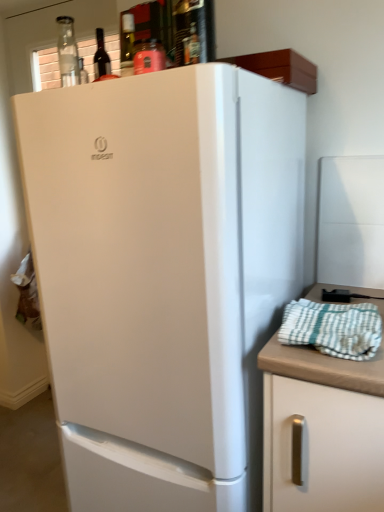
Image resolution: width=384 pixels, height=512 pixels. What are the coordinates of `matte glass wine bottle at upper center` in the screenshot? It's located at (101, 58).

Locate an element on the screen. The image size is (384, 512). matte glass wine bottle at upper center is located at coordinates (101, 58).

This screenshot has width=384, height=512. Identify the location of refrigerator on the left of white checkered towel at right. (163, 276).

How much distance is there between white matte refrigerator at center and white checkered towel at right?

A distance of 37.03 centimeters exists between white matte refrigerator at center and white checkered towel at right.

Is white matte refrigerator at center far from white checkered towel at right?

No, there isn't a large distance between white matte refrigerator at center and white checkered towel at right.

Does white matte refrigerator at center have a smaller size compared to white checkered towel at right?

No.

Is matte glass wine bottle at upper center positioned with its back to white checkered towel at right?

No, white checkered towel at right is not at the back of matte glass wine bottle at upper center.

Would you say matte glass wine bottle at upper center is outside white checkered towel at right?

matte glass wine bottle at upper center is positioned outside white checkered towel at right.

In the image, is matte glass wine bottle at upper center positioned in front of or behind white checkered towel at right?

In the image, matte glass wine bottle at upper center appears behind white checkered towel at right.

Which of these two, matte glass wine bottle at upper center or white checkered towel at right, is bigger?

With larger size is white checkered towel at right.

Is the surface of white matte cabinet at right in direct contact with white matte refrigerator at center?

white matte cabinet at right and white matte refrigerator at center are not in contact.

Who is shorter, white matte cabinet at right or white matte refrigerator at center?

With less height is white matte cabinet at right.

Which object is thinner, white matte cabinet at right or white matte refrigerator at center?

white matte cabinet at right is thinner.

Can you confirm if white matte refrigerator at center is bigger than white matte cabinet at right?

Indeed, white matte refrigerator at center has a larger size compared to white matte cabinet at right.

Considering the positions of points (206, 289) and (368, 372), is point (206, 289) farther from camera compared to point (368, 372)?

Yes, point (206, 289) is behind point (368, 372).

From a real-world perspective, is white matte refrigerator at center positioned above or below white matte cabinet at right?

white matte refrigerator at center is above white matte cabinet at right.

Is white matte refrigerator at center to the left or to the right of white matte cabinet at right in the image?

white matte refrigerator at center is to the left of white matte cabinet at right.

Considering the sizes of matte glass wine bottle at upper center and white matte refrigerator at center in the image, is matte glass wine bottle at upper center taller or shorter than white matte refrigerator at center?

Considering their sizes, matte glass wine bottle at upper center has less height than white matte refrigerator at center.

Considering the relative positions of matte glass wine bottle at upper center and white matte refrigerator at center in the image provided, is matte glass wine bottle at upper center to the right of white matte refrigerator at center from the viewer's perspective?

Incorrect, matte glass wine bottle at upper center is not on the right side of white matte refrigerator at center.

How distant is matte glass wine bottle at upper center from white matte refrigerator at center?

matte glass wine bottle at upper center is 27.18 inches away from white matte refrigerator at center.

In terms of width, does matte glass wine bottle at upper center look wider or thinner when compared to white matte refrigerator at center?

Considering their sizes, matte glass wine bottle at upper center looks slimmer than white matte refrigerator at center.

Which object is positioned more to the left, white checkered towel at right or white matte cabinet at right?

Positioned to the left is white checkered towel at right.

Are white checkered towel at right and white matte cabinet at right making contact?

No, white checkered towel at right is not with white matte cabinet at right.

What's the angular difference between white checkered towel at right and white matte cabinet at right's facing directions?

They differ by 4.45 degrees in their facing directions.

Considering the sizes of objects white checkered towel at right and white matte cabinet at right in the image provided, who is taller, white checkered towel at right or white matte cabinet at right?

Standing taller between the two is white matte cabinet at right.

Who is more distant, white checkered towel at right or white matte refrigerator at center?

white checkered towel at right.

Is white checkered towel at right far from white matte refrigerator at center?

That's not correct — white checkered towel at right is a little close to white matte refrigerator at center.

Considering the relative sizes of white checkered towel at right and white matte refrigerator at center in the image provided, is white checkered towel at right thinner than white matte refrigerator at center?

Yes.

From the image's perspective, which is above, white checkered towel at right or white matte refrigerator at center?

white checkered towel at right, from the image's perspective.

Find the location of `refrigerator located below the white checkered towel at right (from the image's perspective)`. refrigerator located below the white checkered towel at right (from the image's perspective) is located at coordinates (163, 276).

This screenshot has width=384, height=512. In order to click on wine bottle above the white checkered towel at right (from a real-world perspective) in this screenshot , I will do `click(101, 58)`.

From the image, which object appears to be farther from white checkered towel at right, white matte refrigerator at center or white matte cabinet at right?

The object further to white checkered towel at right is white matte refrigerator at center.

Considering their positions, is white matte refrigerator at center positioned closer to matte glass wine bottle at upper center than white checkered towel at right?

The object closer to matte glass wine bottle at upper center is white matte refrigerator at center.

When comparing their distances from white matte cabinet at right, does matte glass wine bottle at upper center or white matte refrigerator at center seem further?

matte glass wine bottle at upper center lies further to white matte cabinet at right than the other object.

When comparing their distances from white matte refrigerator at center, does matte glass wine bottle at upper center or white checkered towel at right seem further?

Based on the image, matte glass wine bottle at upper center appears to be further to white matte refrigerator at center.

Based on their spatial positions, is white matte refrigerator at center or white checkered towel at right further from white matte cabinet at right?

Among the two, white matte refrigerator at center is located further to white matte cabinet at right.

From the picture: When comparing their distances from matte glass wine bottle at upper center, does white checkered towel at right or white matte cabinet at right seem further?

white matte cabinet at right is positioned further to the anchor matte glass wine bottle at upper center.

From the image, which object appears to be nearer to matte glass wine bottle at upper center, white checkered towel at right or white matte refrigerator at center?

white matte refrigerator at center is closer to matte glass wine bottle at upper center.

Which object lies further to the anchor point white checkered towel at right, matte glass wine bottle at upper center or white matte cabinet at right?

matte glass wine bottle at upper center is further to white checkered towel at right.

Image resolution: width=384 pixels, height=512 pixels. Identify the location of blanket between matte glass wine bottle at upper center and white matte refrigerator at center from top to bottom. coord(333,328).

Identify the location of refrigerator between matte glass wine bottle at upper center and white matte cabinet at right in the up-down direction. The height and width of the screenshot is (512, 384). (163, 276).

You are a GUI agent. You are given a task and a screenshot of the screen. Output one action in this format:
    pyautogui.click(x=<x>, y=<y>)
    Task: Click on the blanket between white matte refrigerator at center and white matte cabinet at right
    
    Given the screenshot: What is the action you would take?
    pyautogui.click(x=333, y=328)

Locate an element on the screen. Image resolution: width=384 pixels, height=512 pixels. blanket between matte glass wine bottle at upper center and white matte cabinet at right in the up-down direction is located at coordinates (333, 328).